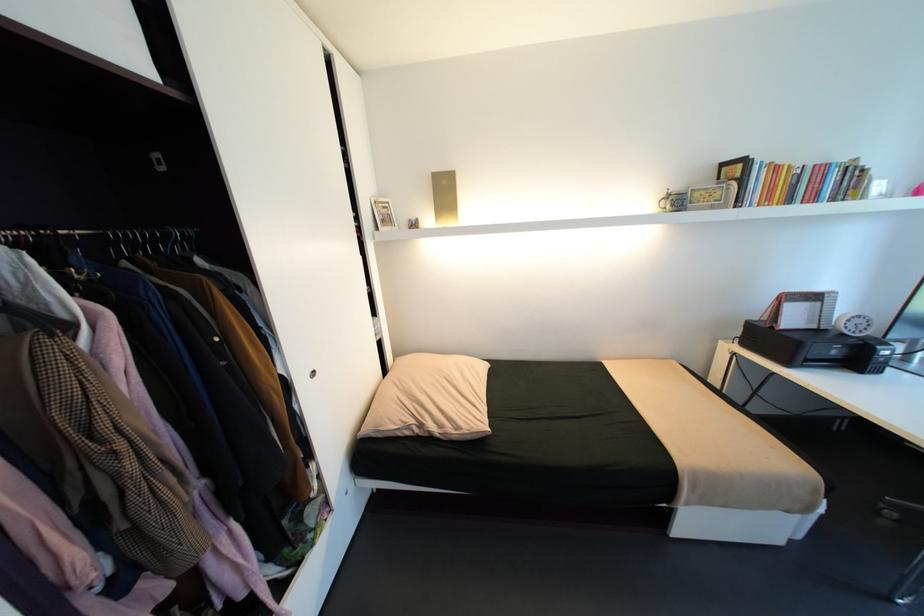
Where is `recessed door pull`? This screenshot has width=924, height=616. recessed door pull is located at coordinates (312, 373).